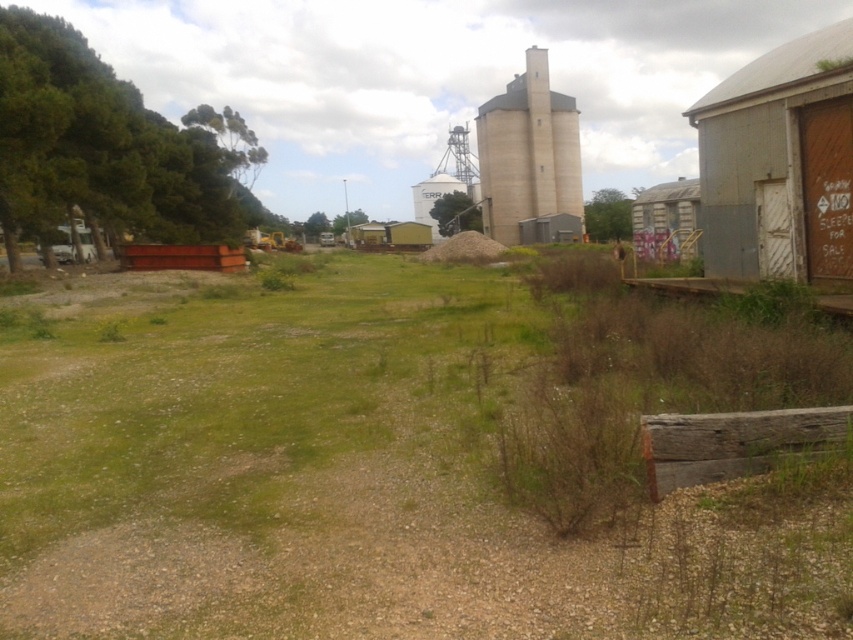
You are a gardener planning to plant flowers between the green grass at center and the beige concrete silo at center. Based on their positions, which object should you start near to begin planting?

You should start near the green grass at center because it is to the left of the beige concrete silo at center, so the area between them begins at the green grass at center.

You are standing at the point marked by the coordinates (403, 467) in the image. What type of terrain are you currently standing on?

The point marked by coordinates (403, 467) corresponds to green grass at center, so you are standing on green grass.

You are a landscape architect designing a new garden. You have to place a small statue that requires a space larger than the green grass at center. Can the beige concrete silo at center accommodate it?

The beige concrete silo at center is larger than the green grass at center, so it can accommodate the statue.